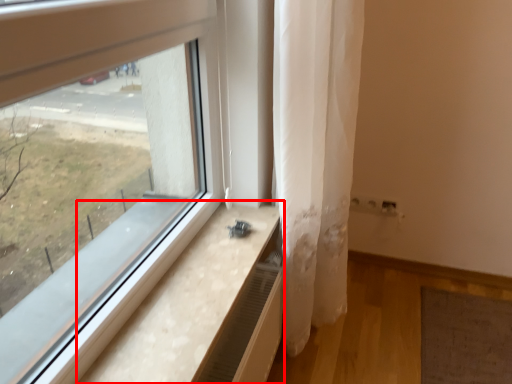
Question: Observing the image, what is the correct spatial positioning of window sill (annotated by the red box) in reference to curtain?

Choices:
 (A) left
 (B) right

Answer: (A)